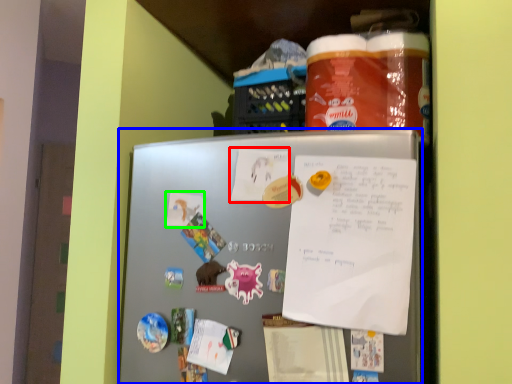
Question: Estimate the real-world distances between objects in this image. Which object is farther from paper (highlighted by a red box), refrigerator (highlighted by a blue box) or paper (highlighted by a green box)?

Choices:
 (A) refrigerator
 (B) paper

Answer: (A)